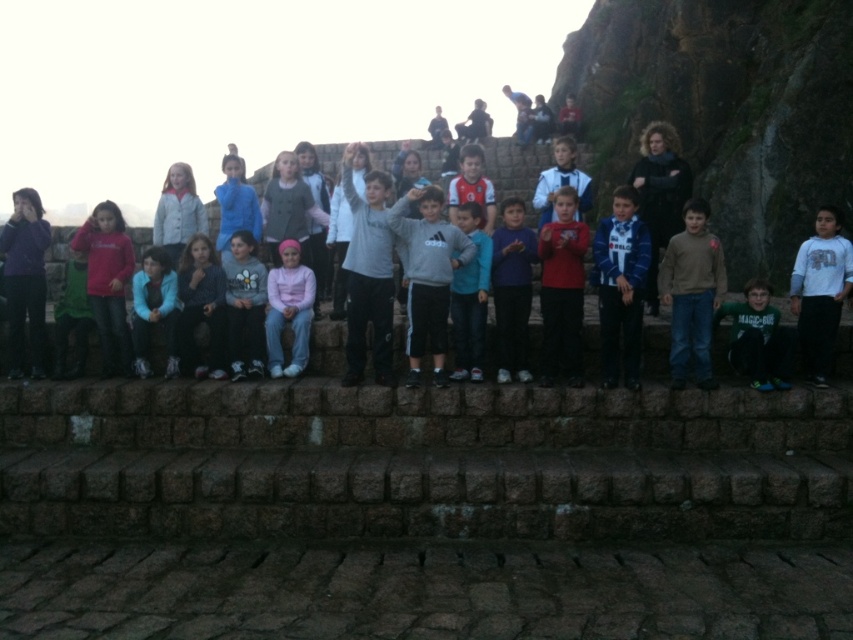
You are a photographer trying to adjust the lighting for the children in the front row. You notice two children wearing the brown cotton sweater at center and the white fleece sweatshirt at center. Which child might need more warmth because of their clothing? Explain your reasoning.

The child wearing the brown cotton sweater at center might need more warmth because the brown cotton sweater at center is thinner than the white fleece sweatshirt at center, which provides better insulation.

You are a photographer trying to adjust the lighting for a group photo. You notice two gray items at the center of the image, a gray sweater at center and a gray fleece jacket at center. Which one is closer to the ground?

The gray sweater at center is positioned under the gray fleece jacket at center, so the gray sweater at center is closer to the ground.